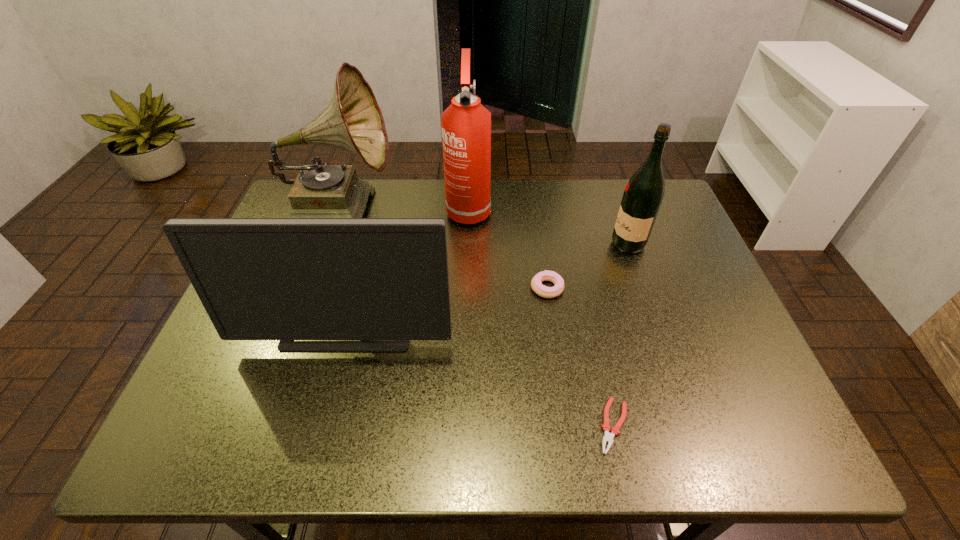
Find the location of a particular element. fire extinguisher is located at coordinates (466, 124).

The width and height of the screenshot is (960, 540). What are the coordinates of `record player` in the screenshot? It's located at (352, 120).

You are a GUI agent. You are given a task and a screenshot of the screen. Output one action in this format:
    pyautogui.click(x=<x>, y=<y>)
    Task: Click on the rightmost object
    Image resolution: width=960 pixels, height=540 pixels.
    Given the screenshot: What is the action you would take?
    pyautogui.click(x=643, y=195)

Identify the location of computer monitor. The height and width of the screenshot is (540, 960). (285, 279).

Identify the location of the fifth tallest object. (543, 291).

This screenshot has height=540, width=960. Identify the location of doughnut. (543, 291).

Find the location of a particular element. The image size is (960, 540). pliers is located at coordinates (608, 437).

This screenshot has width=960, height=540. I want to click on the second object from right to left, so click(x=608, y=437).

The image size is (960, 540). Identify the location of blank space located 0.140m at the nozzle of the fire extinguisher. (467, 262).

The height and width of the screenshot is (540, 960). Identify the location of free space located 0.350m from the horn of the record player. (511, 209).